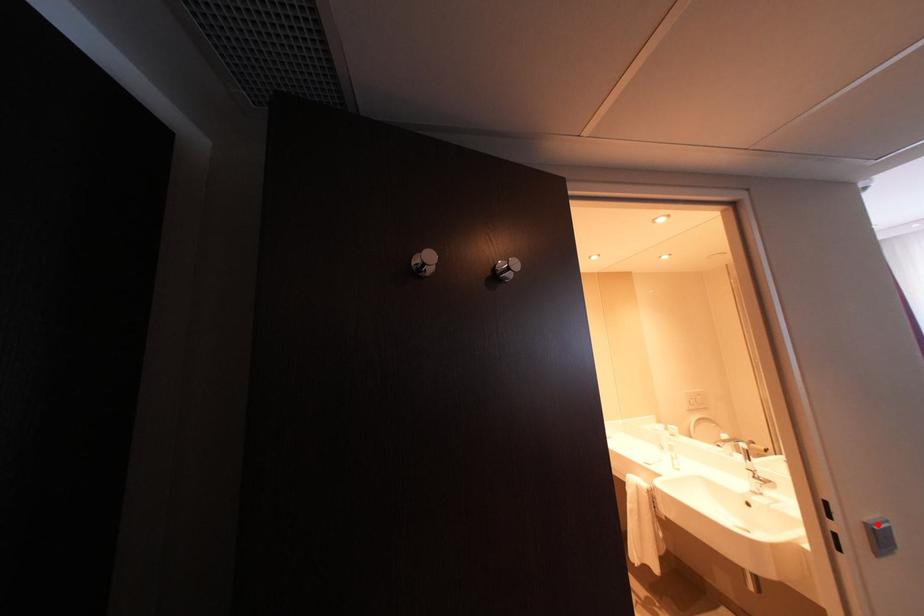
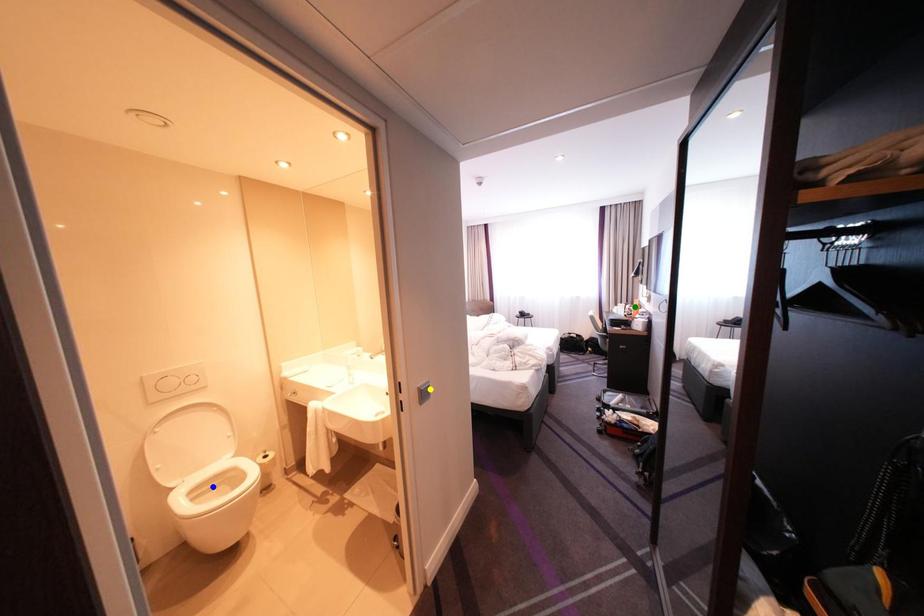
Question: I am providing you with two images of the same scene from different viewpoints. A red point is marked on the first image. You are given multiple points on the second image. Which spot in image 2 lines up with the point in image 1?

Choices:
 (A) green point
 (B) yellow point
 (C) blue point

Answer: (B)